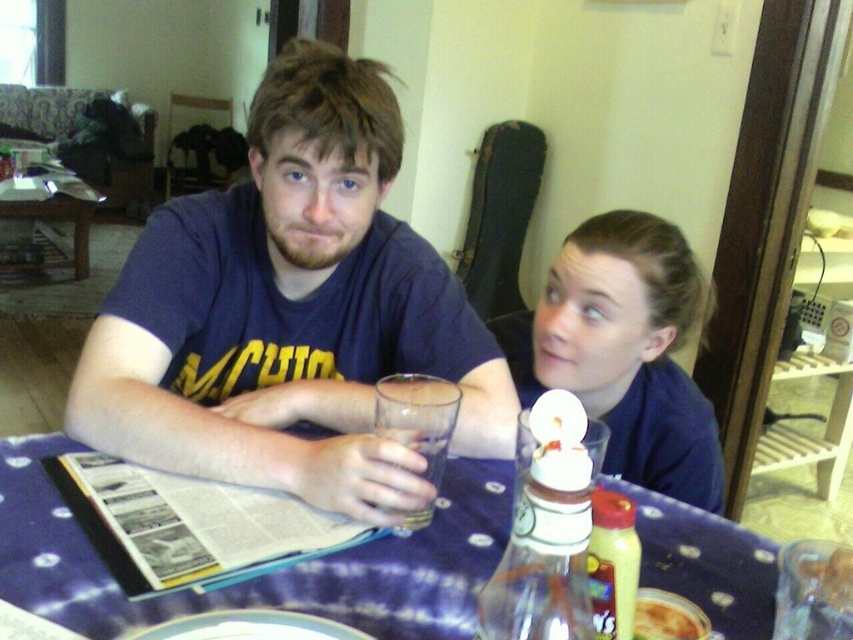
Question: Can you confirm if matte blue shirt at center is positioned above yellowish matte pizza at lower center?

Choices:
 (A) no
 (B) yes

Answer: (B)

Question: Can you confirm if matte blue shirt at center is positioned to the right of transparent glass at table?

Choices:
 (A) no
 (B) yes

Answer: (A)

Question: Among these points, which one is nearest to the camera?

Choices:
 (A) (671, 596)
 (B) (33, 554)
 (C) (419, 518)
 (D) (76, 195)

Answer: (B)

Question: Which point appears farthest from the camera in this image?

Choices:
 (A) (701, 525)
 (B) (437, 436)
 (C) (590, 352)

Answer: (C)

Question: Which point is closer to the camera?

Choices:
 (A) wooden table at left
 (B) matte blue shirt at center

Answer: (B)

Question: Considering the relative positions of wooden table at left and transparent glass at table in the image provided, where is wooden table at left located with respect to transparent glass at table?

Choices:
 (A) right
 (B) left

Answer: (B)